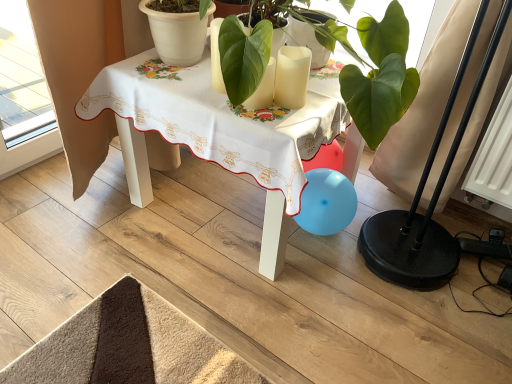
Question: Is the depth of white matte flowerpot at upper center greater than that of white matte candle at center?

Choices:
 (A) no
 (B) yes

Answer: (B)

Question: Is white matte flowerpot at upper center wider than white matte candle at center?

Choices:
 (A) yes
 (B) no

Answer: (A)

Question: Is white matte flowerpot at upper center directly adjacent to white matte candle at center?

Choices:
 (A) no
 (B) yes

Answer: (A)

Question: Considering the relative sizes of white matte flowerpot at upper center and white matte candle at center in the image provided, is white matte flowerpot at upper center bigger than white matte candle at center?

Choices:
 (A) no
 (B) yes

Answer: (B)

Question: Is white matte flowerpot at upper center shorter than white matte candle at center?

Choices:
 (A) no
 (B) yes

Answer: (A)

Question: Is white matte flowerpot at upper center positioned with its back to white matte candle at center?

Choices:
 (A) yes
 (B) no

Answer: (B)

Question: Does white fabric table at center have a larger size compared to white matte candle at center?

Choices:
 (A) yes
 (B) no

Answer: (A)

Question: Can you confirm if white fabric table at center is wider than white matte candle at center?

Choices:
 (A) no
 (B) yes

Answer: (B)

Question: Is white fabric table at center closer to camera compared to white matte candle at center?

Choices:
 (A) no
 (B) yes

Answer: (B)

Question: Is white fabric table at center to the right of white matte candle at center from the viewer's perspective?

Choices:
 (A) yes
 (B) no

Answer: (B)

Question: Can you confirm if white fabric table at center is thinner than white matte candle at center?

Choices:
 (A) yes
 (B) no

Answer: (B)

Question: Can white matte candle at center be found inside white fabric table at center?

Choices:
 (A) yes
 (B) no

Answer: (B)

Question: Is white matte flowerpot at upper center turned away from white fabric table at center?

Choices:
 (A) no
 (B) yes

Answer: (A)